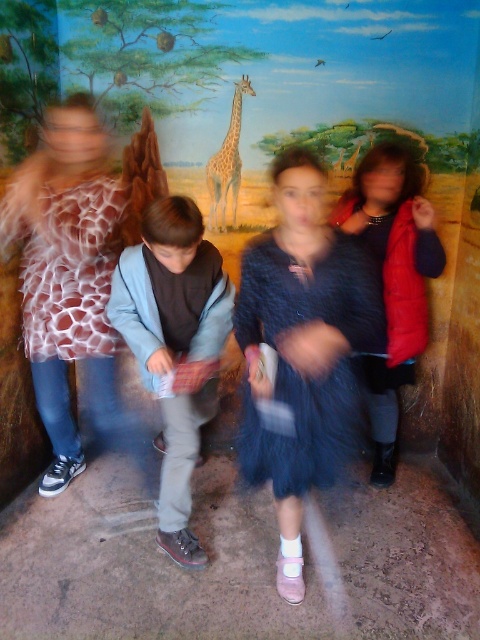
Can you confirm if velvet red vest at right is shorter than spotted fur giraffe at center?

No.

Can you confirm if velvet red vest at right is positioned to the right of spotted fur giraffe at center?

Correct, you'll find velvet red vest at right to the right of spotted fur giraffe at center.

Image resolution: width=480 pixels, height=640 pixels. Describe the element at coordinates (393, 280) in the screenshot. I see `velvet red vest at right` at that location.

Find the location of a particular element. This screenshot has width=480, height=640. velvet red vest at right is located at coordinates (393, 280).

What do you see at coordinates (301, 348) in the screenshot? I see `velvet blue dress at center` at bounding box center [301, 348].

Is velvet blue dress at center positioned before velvet red vest at right?

Yes, it is.

Who is more forward, (324, 250) or (414, 205)?

Point (324, 250)

Identify the location of velvet blue dress at center. (301, 348).

Is point (168, 300) more distant than point (376, 173)?

No, (168, 300) is closer to viewer.

Between light blue denim jacket at center and velvet red vest at right, which one has less height?

light blue denim jacket at center

Locate an element on the screen. light blue denim jacket at center is located at coordinates (175, 346).